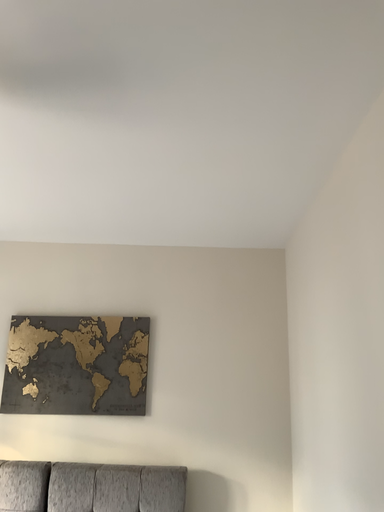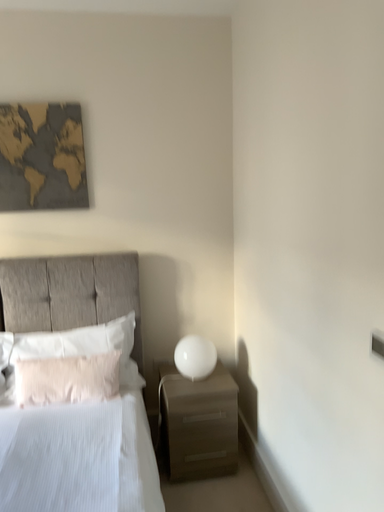
Question: Which way did the camera rotate in the video?

Choices:
 (A) rotated downward
 (B) rotated upward

Answer: (A)